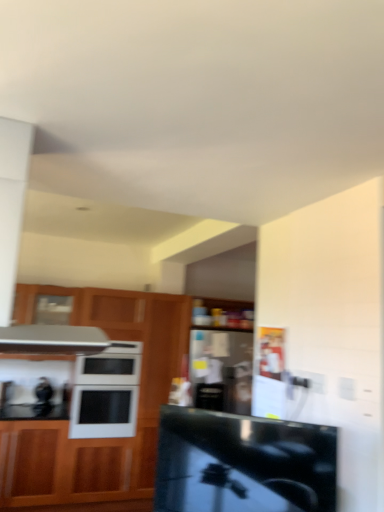
Question: From the image's perspective, is black glossy countertop at center located above or below wooden cabinet at left?

Choices:
 (A) above
 (B) below

Answer: (A)

Question: Is point (244, 483) positioned closer to the camera than point (52, 490)?

Choices:
 (A) closer
 (B) farther

Answer: (A)

Question: Which object is positioned closest to the white glossy microwave oven at center?

Choices:
 (A) black glossy countertop at center
 (B) wooden cabinet at left

Answer: (B)

Question: Which of these objects is positioned closest to the white glossy microwave oven at center?

Choices:
 (A) black glossy countertop at center
 (B) wooden cabinet at left

Answer: (B)